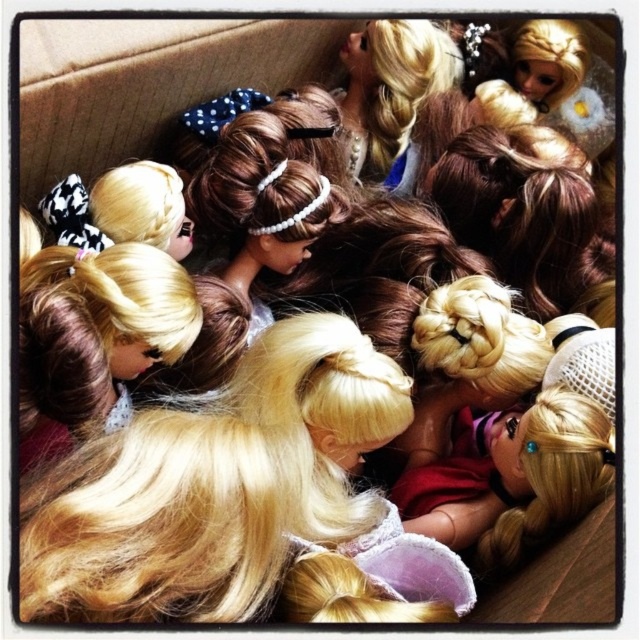
Question: Does blonde hair at center have a lesser width compared to blonde silky hair at center?

Choices:
 (A) yes
 (B) no

Answer: (B)

Question: Which point appears closest to the camera in this image?

Choices:
 (A) (157, 445)
 (B) (552, 448)

Answer: (A)

Question: Does blonde hair at center have a greater width compared to blonde silky hair at center?

Choices:
 (A) no
 (B) yes

Answer: (B)

Question: Is blonde hair at center thinner than blonde silky hair at center?

Choices:
 (A) yes
 (B) no

Answer: (B)

Question: Which point appears closest to the camera in this image?

Choices:
 (A) (547, 492)
 (B) (449, 618)

Answer: (B)